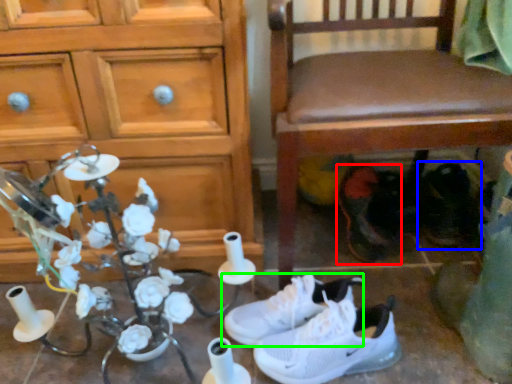
Question: Which is nearer to the footwear (highlighted by a red box)? footwear (highlighted by a blue box) or footwear (highlighted by a green box).

Choices:
 (A) footwear
 (B) footwear

Answer: (A)